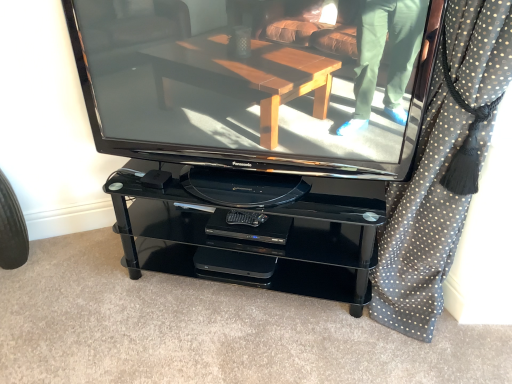
This screenshot has height=384, width=512. In order to click on vacant region to the left of black dotted fabric at right in this screenshot , I will do `click(325, 337)`.